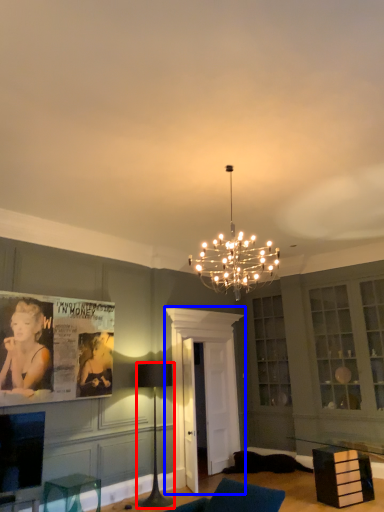
Question: Which point is closer to the camera, lamp (highlighted by a red box) or glass door (highlighted by a blue box)?

Choices:
 (A) lamp
 (B) glass door

Answer: (A)